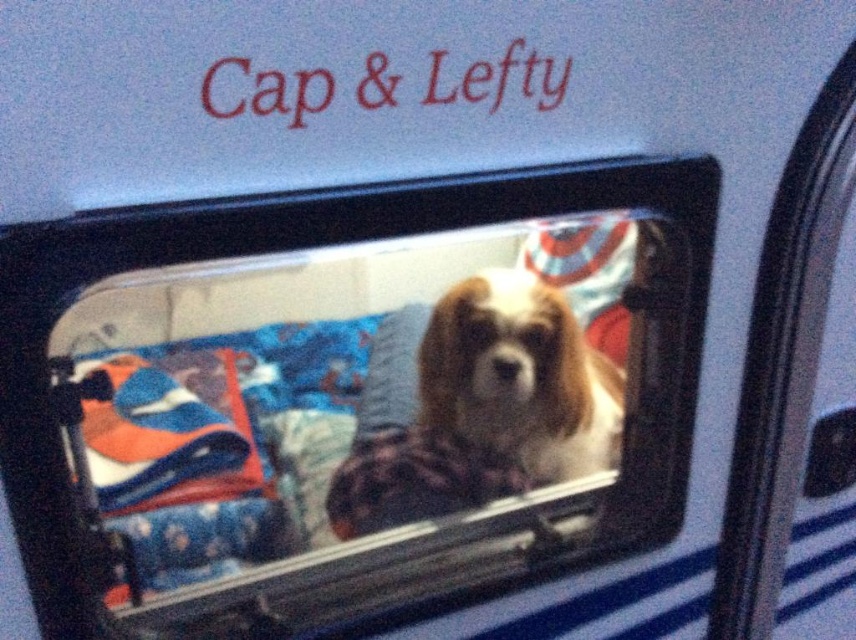
You are a dog owner who wants to place a new toy between the clear glass dog at center and the white fur dog at center. Where should you place the toy so that it is exactly in the middle between them?

Place the toy exactly between the clear glass dog at center and the white fur dog at center, ensuring it is equidistant from both. Since the clear glass dog at center is to the left of the white fur dog at center, the toy should be positioned halfway between their current locations.

You are a delivery robot with a package that needs to be placed between the clear glass dog at center and the white fur dog at center. The package is 3 inches long. Will the package fit between them?

The distance between the clear glass dog at center and the white fur dog at center is 3.20 inches, so the 3 inch package will fit between them.